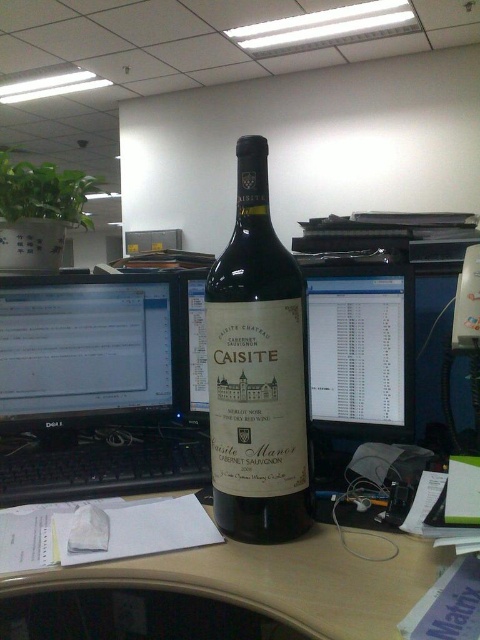
You are organizing your desk and want to move a cable from the black glossy monitor at left to the matte black monitor at center. Which monitor should you plug the cable into first to ensure it reaches both without needing to adjust the desk layout?

You should plug the cable into the matte black monitor at center first because the black glossy monitor at left is closer to the viewer, so starting with the farther matte black monitor ensures the cable can comfortably reach both monitors without needing to adjust the desk layout.

You are organizing your desk and want to place a new keyboard between the matte glass wine bottle at center and the matte black monitor at center. The keyboard is 10 inches long. Will it fit without overlapping either item?

The distance between the matte glass wine bottle at center and the matte black monitor at center is 10.30 inches. Since the keyboard is 10 inches long, it will fit between them without overlapping either item.

You need to place a new keyboard that is 15 cm wide on the desk. The black glossy monitor at left and the matte glass wine bottle at center are already on the desk. Which object has enough space next to it to fit the keyboard?

The black glossy monitor at left has a larger width than the matte glass wine bottle at center, so there is more space next to it to accommodate the 15 cm wide keyboard.